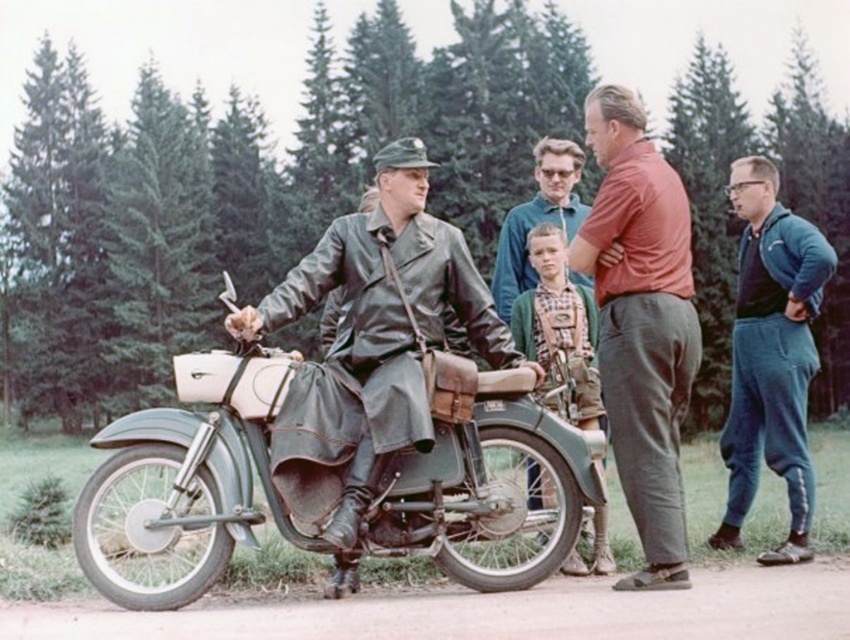
You are a hiker who wants to retrieve the green wool sweater at center from the green matte motorcycle at center. Which direction should you move relative to the motorcycle to reach the sweater?

The green wool sweater at center is to the right of the green matte motorcycle at center, so you should move to the right side of the motorcycle to reach it.

You are an observer standing in front of the vintage motorcycle. You notice two items near the motorcycle. The first is dark blue sweatpants at right and the second is green wool sweater at center. Which item is larger?

The green wool sweater at center is larger than the dark blue sweatpants at right.

You are a hiker who has just arrived at the scene and wants to put on warm clothing. You see the dark blue sweatpants at right and the green wool sweater at center. Which item is located lower in the scene?

The dark blue sweatpants at right is below green wool sweater at center, so the dark blue sweatpants at right is located lower in the scene.